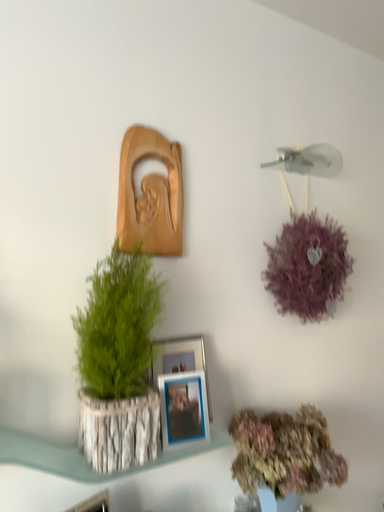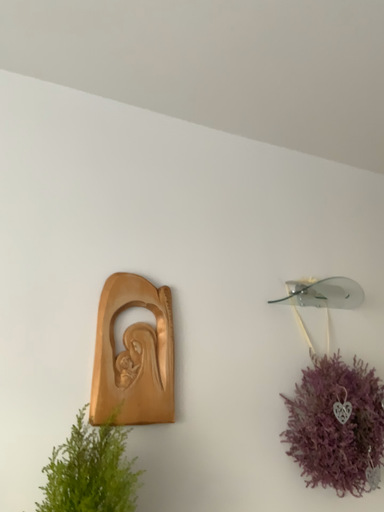
Question: How did the camera likely rotate when shooting the video?

Choices:
 (A) rotated downward
 (B) rotated upward

Answer: (B)